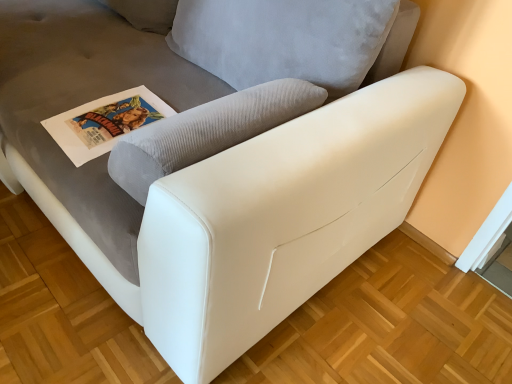
Measure the distance between point (73,110) and camera.

Point (73,110) is 1.12 meters from camera.

Where is `matte paper poster at upper left`? matte paper poster at upper left is located at coordinates (104, 122).

Image resolution: width=512 pixels, height=384 pixels. What do you see at coordinates (104, 122) in the screenshot? I see `matte paper poster at upper left` at bounding box center [104, 122].

In order to face matte paper poster at upper left, should I rotate leftwards or rightwards?

It's best to rotate left around 17.740 degrees.

Locate an element on the screen. Image resolution: width=512 pixels, height=384 pixels. matte paper poster at upper left is located at coordinates (104, 122).